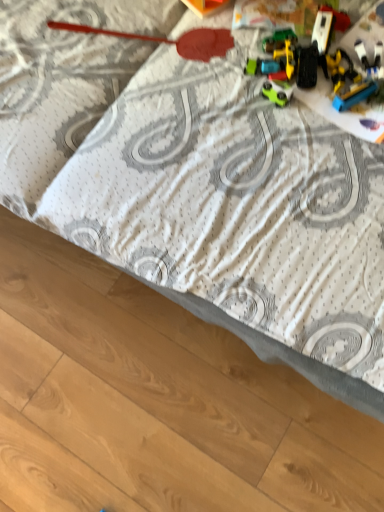
Question: Considering the positions of yellow plastic toy truck at upper right, which is the first toy in right-to-left order, and green matte car at center, placed as the third toy when sorted from right to left, in the image, is yellow plastic toy truck at upper right, which is the first toy in right-to-left order, bigger or smaller than green matte car at center, placed as the third toy when sorted from right to left,?

Choices:
 (A) big
 (B) small

Answer: (A)

Question: Looking at their shapes, would you say yellow plastic toy truck at upper right, which is counted as the 4th toy, starting from the left, is wider or thinner than green matte car at center, placed as the third toy when sorted from right to left?

Choices:
 (A) wide
 (B) thin

Answer: (A)

Question: Which object is positioned closest to the multicolored plastic toy cars at upper right, positioned as the 3th toy in left-to-right order?

Choices:
 (A) green matte car at center, the second toy positioned from the left
 (B) metallic red spatula at upper center, positioned as the 1th toy in left-to-right order
 (C) yellow plastic toy truck at upper right, which is the first toy in right-to-left order

Answer: (C)

Question: Based on their relative distances, which object is nearer to the green matte car at center, the second toy positioned from the left?

Choices:
 (A) multicolored plastic toy cars at upper right, acting as the second toy starting from the right
 (B) metallic red spatula at upper center, positioned as the 1th toy in left-to-right order
 (C) yellow plastic toy truck at upper right, which is counted as the 4th toy, starting from the left

Answer: (C)